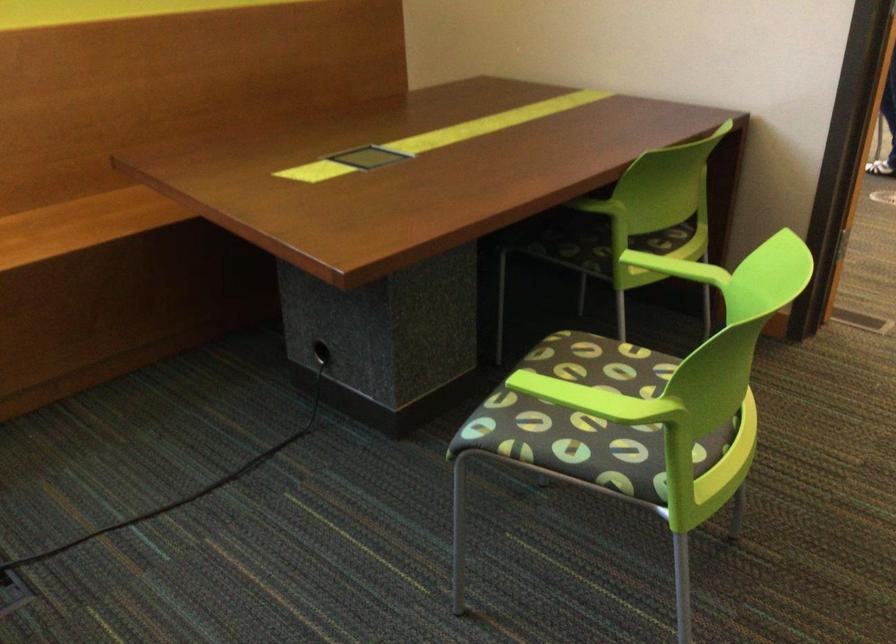
Where would you sit the wooden sofa sitting surface? Please return your answer as a coordinate pair (x, y).

(80, 223)